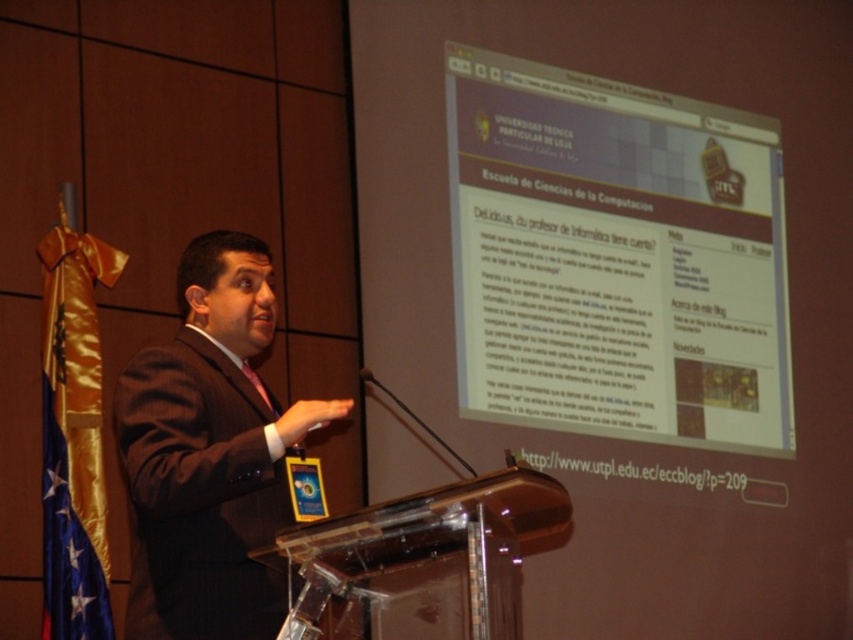
Based on the photo, which of these two, matte plastic screen at upper right or blue satin flag at left, stands taller?

matte plastic screen at upper right is taller.

Between matte plastic screen at upper right and blue satin flag at left, which one has less height?

With less height is blue satin flag at left.

The width and height of the screenshot is (853, 640). What do you see at coordinates (614, 259) in the screenshot?
I see `matte plastic screen at upper right` at bounding box center [614, 259].

Locate an element on the screen. This screenshot has width=853, height=640. matte plastic screen at upper right is located at coordinates (614, 259).

In the scene shown: Does brown suit at center appear over blue satin flag at left?

Yes.

Can you confirm if brown suit at center is taller than blue satin flag at left?

Incorrect, brown suit at center's height is not larger of blue satin flag at left's.

Does point (173, 342) come behind point (70, 618)?

No, it is not.

This screenshot has width=853, height=640. In order to click on brown suit at center in this screenshot , I will do `click(209, 452)`.

Between matte plastic screen at upper right and brown suit at center, which one has more height?

matte plastic screen at upper right is taller.

Does matte plastic screen at upper right appear under brown suit at center?

Actually, matte plastic screen at upper right is above brown suit at center.

This screenshot has height=640, width=853. What are the coordinates of `matte plastic screen at upper right` in the screenshot? It's located at (614, 259).

Image resolution: width=853 pixels, height=640 pixels. Identify the location of matte plastic screen at upper right. pos(614,259).